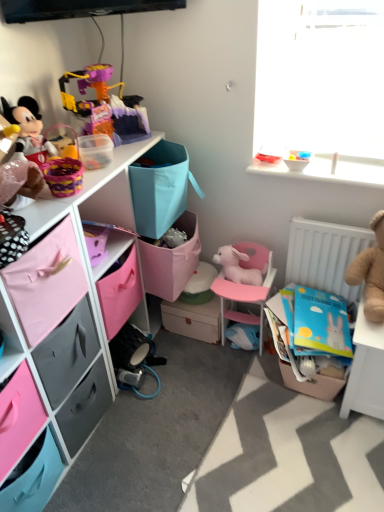
Question: Is pink plastic chair at center wider than pink plush rabbit at center, which is the 3th toy in left-to-right order?

Choices:
 (A) no
 (B) yes

Answer: (B)

Question: Considering the relative sizes of pink plastic chair at center and pink plush rabbit at center, which is the 5th toy in right-to-left order, in the image provided, is pink plastic chair at center thinner than pink plush rabbit at center, which is the 5th toy in right-to-left order,?

Choices:
 (A) yes
 (B) no

Answer: (B)

Question: Considering the relative sizes of pink plastic chair at center and pink plush rabbit at center, which is the 5th toy in right-to-left order, in the image provided, is pink plastic chair at center taller than pink plush rabbit at center, which is the 5th toy in right-to-left order,?

Choices:
 (A) no
 (B) yes

Answer: (B)

Question: Can you confirm if pink plastic chair at center is positioned to the right of pink plush rabbit at center, which is the 5th toy in right-to-left order?

Choices:
 (A) yes
 (B) no

Answer: (A)

Question: From the image's perspective, is pink plastic chair at center below pink plush rabbit at center, which is the 3th toy in left-to-right order?

Choices:
 (A) no
 (B) yes

Answer: (B)

Question: Is pink plastic chair at center aimed at pink plush rabbit at center, which is the 3th toy in left-to-right order?

Choices:
 (A) no
 (B) yes

Answer: (A)

Question: Is matte pink storage box at center, arranged as the 2th storage box when viewed from the front, at the left side of matte black plush toy at left, which ranks as the 1th toy in left-to-right order?

Choices:
 (A) no
 (B) yes

Answer: (A)

Question: From a real-world perspective, is matte pink storage box at center, placed as the 1th storage box when sorted from back to front, physically below matte black plush toy at left, which is counted as the seventh toy, starting from the right?

Choices:
 (A) yes
 (B) no

Answer: (A)

Question: Is matte pink storage box at center, arranged as the 2th storage box when viewed from the front, thinner than matte black plush toy at left, which is counted as the seventh toy, starting from the right?

Choices:
 (A) no
 (B) yes

Answer: (B)

Question: Is the position of matte pink storage box at center, placed as the 1th storage box when sorted from back to front, less distant than that of matte black plush toy at left, which is counted as the seventh toy, starting from the right?

Choices:
 (A) yes
 (B) no

Answer: (B)

Question: Is matte pink storage box at center, the second storage box when ordered from right to left, further to the viewer compared to matte black plush toy at left, which ranks as the 1th toy in left-to-right order?

Choices:
 (A) yes
 (B) no

Answer: (A)

Question: Can you confirm if matte pink storage box at center, placed as the 1th storage box when sorted from back to front, is wider than matte black plush toy at left, which ranks as the 1th toy in left-to-right order?

Choices:
 (A) yes
 (B) no

Answer: (B)

Question: Are pink fabric drawer at lower left, which is the first drawer in front-to-back order, and matte black plush toy at left, which is counted as the seventh toy, starting from the right, located far from each other?

Choices:
 (A) no
 (B) yes

Answer: (A)